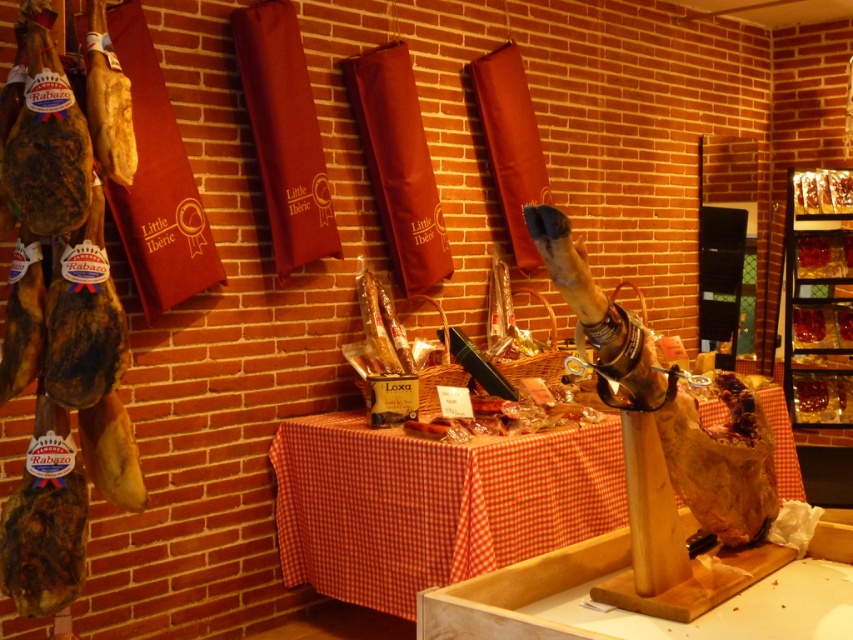
Which is more to the left, brown leather ham at left or red checkered fabric table at center?

brown leather ham at left

Does brown leather ham at left have a greater width compared to red checkered fabric table at center?

In fact, brown leather ham at left might be narrower than red checkered fabric table at center.

Which is behind, point (99, 388) or point (387, 440)?

Point (387, 440)

Where is `brown leather ham at left`? Image resolution: width=853 pixels, height=640 pixels. brown leather ham at left is located at coordinates (67, 243).

Does translucent glass shelves at upper right have a greater height compared to golden-brown crispy pastry at center?

Yes, translucent glass shelves at upper right is taller than golden-brown crispy pastry at center.

Is translucent glass shelves at upper right further to the viewer compared to golden-brown crispy pastry at center?

No, translucent glass shelves at upper right is closer to the viewer.

Identify the location of translucent glass shelves at upper right. (817, 298).

The height and width of the screenshot is (640, 853). I want to click on translucent glass shelves at upper right, so click(x=817, y=298).

Which is more to the left, brown leather ham at left or shiny red jam at center?

brown leather ham at left

Between point (30, 179) and point (810, 337), which one is positioned behind?

The point (810, 337) is behind.

You are a GUI agent. You are given a task and a screenshot of the screen. Output one action in this format:
    pyautogui.click(x=<x>, y=<y>)
    Task: Click on the brown leather ham at left
    The image size is (853, 640).
    Given the screenshot: What is the action you would take?
    pyautogui.click(x=67, y=243)